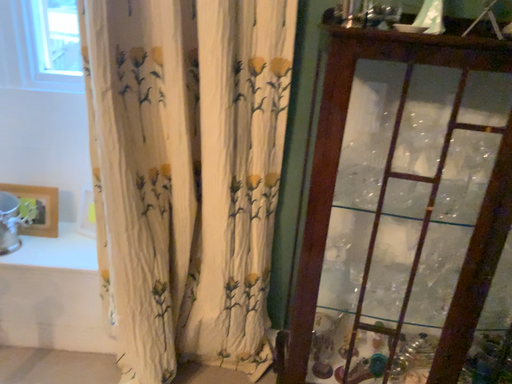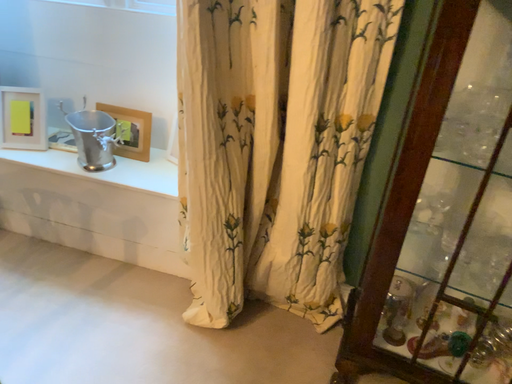
Question: How did the camera likely rotate when shooting the video?

Choices:
 (A) rotated left
 (B) rotated right

Answer: (A)